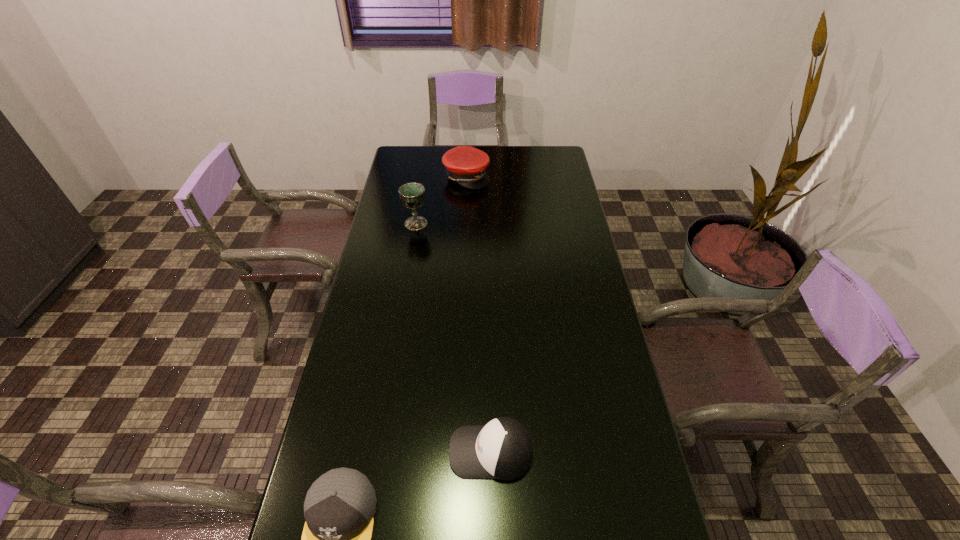
Find the location of a particular element. Image resolution: width=960 pixels, height=540 pixels. chalice is located at coordinates (412, 195).

You are a GUI agent. You are given a task and a screenshot of the screen. Output one action in this format:
    pyautogui.click(x=<x>, y=<y>)
    Task: Click on the third nearest object
    
    Given the screenshot: What is the action you would take?
    pyautogui.click(x=412, y=195)

The width and height of the screenshot is (960, 540). I want to click on the farthest cap, so click(466, 165).

Locate an element on the screen. free spot located 0.200m on the right of the chalice is located at coordinates (480, 224).

The image size is (960, 540). Find the location of `blank area located 0.110m on the front-facing side of the farthest cap`. blank area located 0.110m on the front-facing side of the farthest cap is located at coordinates (515, 176).

Find the location of a particular element. object at the far edge is located at coordinates (466, 165).

The width and height of the screenshot is (960, 540). Identify the location of object situated at the left edge. (x=412, y=195).

This screenshot has height=540, width=960. In the image, there is a desktop. Find the location of `vacant space at the far edge`. vacant space at the far edge is located at coordinates (523, 154).

This screenshot has width=960, height=540. Identify the location of free spot at the left edge of the desktop. (383, 214).

Locate an element on the screen. This screenshot has height=540, width=960. vacant position at the right edge of the desktop is located at coordinates [573, 212].